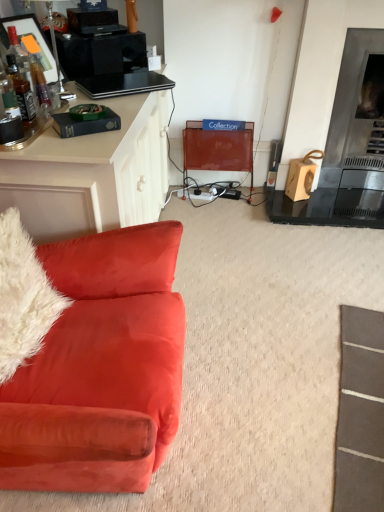
Question: Considering the positions of metallic silver fireplace at right and metallic mesh swivel chair at center in the image, is metallic silver fireplace at right wider or thinner than metallic mesh swivel chair at center?

Choices:
 (A) wide
 (B) thin

Answer: (B)

Question: In terms of height, does metallic silver fireplace at right look taller or shorter compared to metallic mesh swivel chair at center?

Choices:
 (A) tall
 (B) short

Answer: (A)

Question: Which of these objects is positioned closest to the metallic mesh swivel chair at center?

Choices:
 (A) velvet orange couch at left
 (B) metallic silver fireplace at right
 (C) white fluffy pillow at left

Answer: (B)

Question: Which object is positioned closest to the velvet orange couch at left?

Choices:
 (A) white fluffy pillow at left
 (B) metallic mesh swivel chair at center
 (C) metallic silver fireplace at right

Answer: (A)